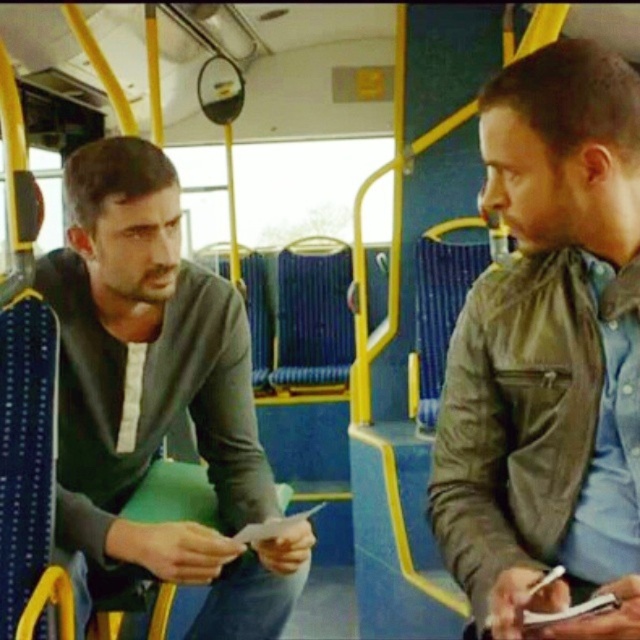
Question: Which of the following is the farthest from the observer?

Choices:
 (A) leather jacket at right
 (B) dark gray sweater at left

Answer: (B)

Question: Is leather jacket at right below dark gray sweater at left?

Choices:
 (A) yes
 (B) no

Answer: (B)

Question: Considering the relative positions of leather jacket at right and dark gray sweater at left in the image provided, where is leather jacket at right located with respect to dark gray sweater at left?

Choices:
 (A) right
 (B) left

Answer: (A)

Question: Which point appears closest to the camera in this image?

Choices:
 (A) (513, 620)
 (B) (134, 189)

Answer: (A)

Question: Does leather jacket at right appear on the left side of dark gray sweater at left?

Choices:
 (A) yes
 (B) no

Answer: (B)